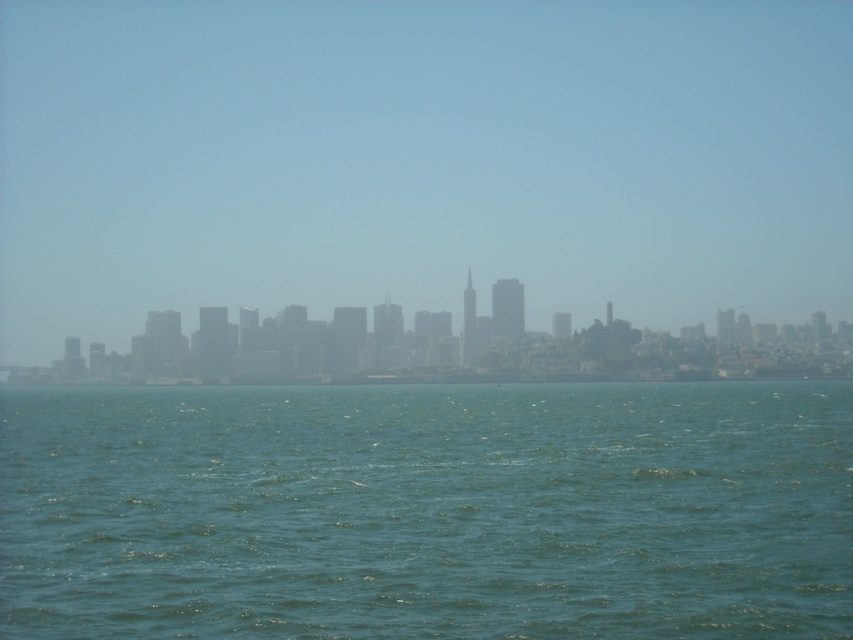
You are an architect analyzing the cityscape in the image. You observe the transparent foggy skyline at center and the gray foggy skyline at center. Which of these two skylines is positioned higher in the image?

The transparent foggy skyline at center is positioned higher in the image than the gray foggy skyline at center.

You are a photographer standing at the edge of the water in the image. You want to capture a photo that includes both the green water at lower center and the gray foggy skyline at center. What should you do to ensure both elements are in the frame?

Since the distance between the green water at lower center and the gray foggy skyline at center is 178.21 meters, you should use a wide angle lens to capture both elements in the frame.

You are standing at the observation deck of the tallest building in the city. You notice two points in the scene labeled as point (74, 600) and point (796, 332). Which point would appear closer to you from your vantage point?

Point (74, 600) is closer to the camera than point (796, 332), so it would appear closer to you from your vantage point.